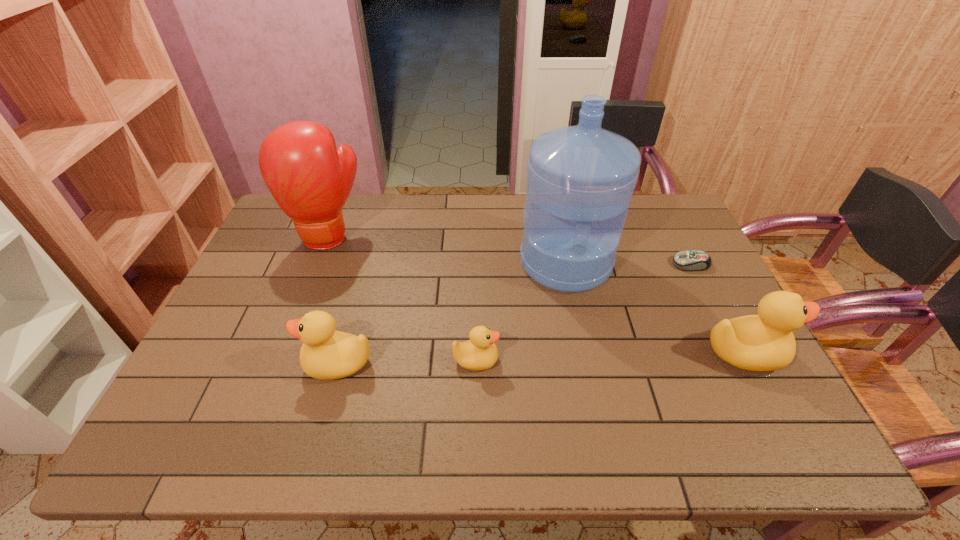
The width and height of the screenshot is (960, 540). I want to click on the fourth tallest object, so click(x=327, y=354).

Identify the location of the second tallest duck. The height and width of the screenshot is (540, 960). (327, 354).

Where is `the second duck from left to right`? The image size is (960, 540). the second duck from left to right is located at coordinates (479, 353).

Find the location of `the second shortest object`. the second shortest object is located at coordinates (479, 353).

The height and width of the screenshot is (540, 960). Find the location of `the rightmost duck`. the rightmost duck is located at coordinates (765, 342).

I want to click on computer mouse, so click(692, 260).

In order to click on water jug in this screenshot , I will do `click(580, 179)`.

Where is `the third object from right to left`? the third object from right to left is located at coordinates (580, 179).

The width and height of the screenshot is (960, 540). Identify the location of the second tallest object. (310, 180).

Identify the location of vacant region located 0.220m at the beak of the leftmost duck. (215, 363).